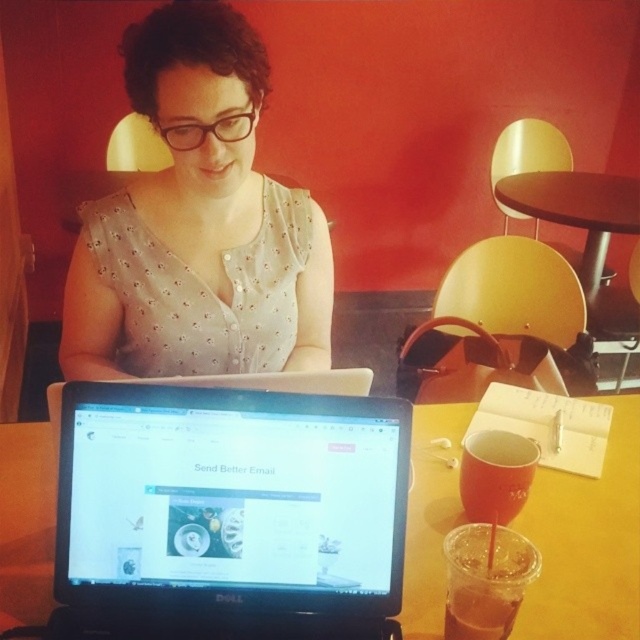
Question: Does black matte laptop at lower center have a greater width compared to translucent plastic cup at lower center?

Choices:
 (A) no
 (B) yes

Answer: (B)

Question: Does black matte laptop at lower center appear on the right side of translucent plastic cup at lower center?

Choices:
 (A) no
 (B) yes

Answer: (A)

Question: Which of the following is the farthest from the observer?

Choices:
 (A) (577, 176)
 (B) (168, 179)
 (C) (464, 532)

Answer: (A)

Question: Is black matte laptop at lower center to the right of matte white blouse at center from the viewer's perspective?

Choices:
 (A) no
 (B) yes

Answer: (B)

Question: Which object is positioned farthest from the brown wooden table at upper right?

Choices:
 (A) matte white blouse at center
 (B) translucent plastic cup at lower center
 (C) black matte laptop at lower center

Answer: (B)

Question: Which object is positioned closest to the brown wooden table at upper right?

Choices:
 (A) black matte laptop at lower center
 (B) matte white blouse at center

Answer: (B)